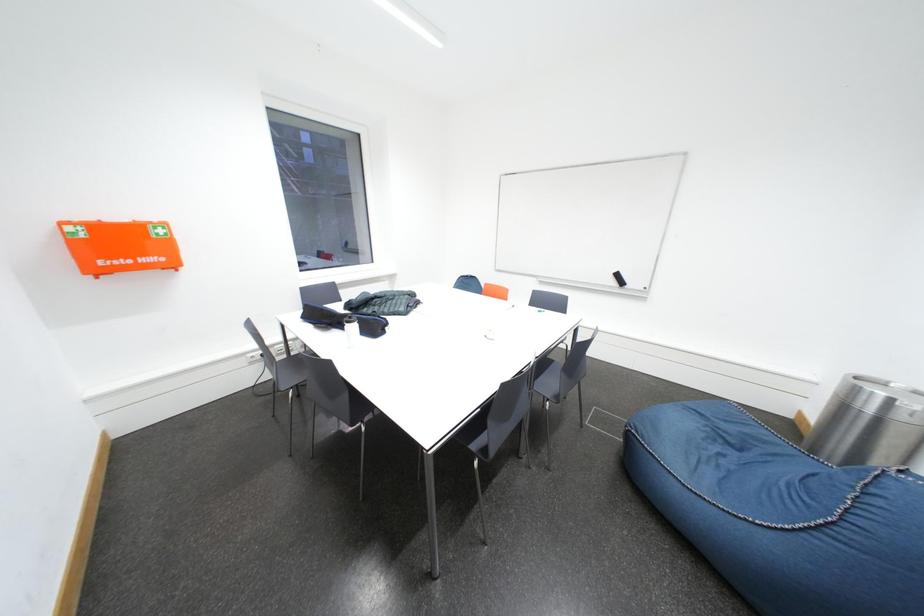
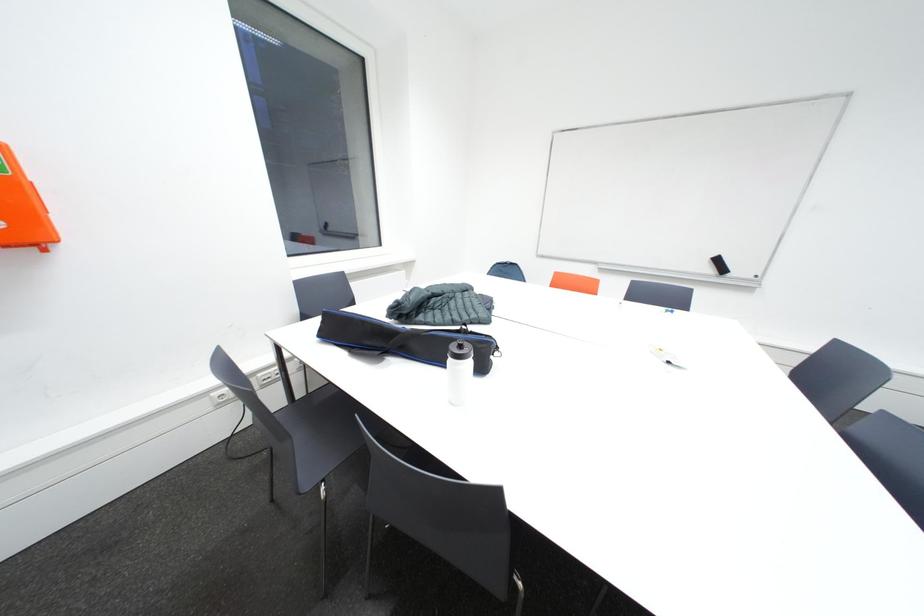
Which direction would the cameraman need to move to produce the second image?

The cameraman moved toward left, forward.